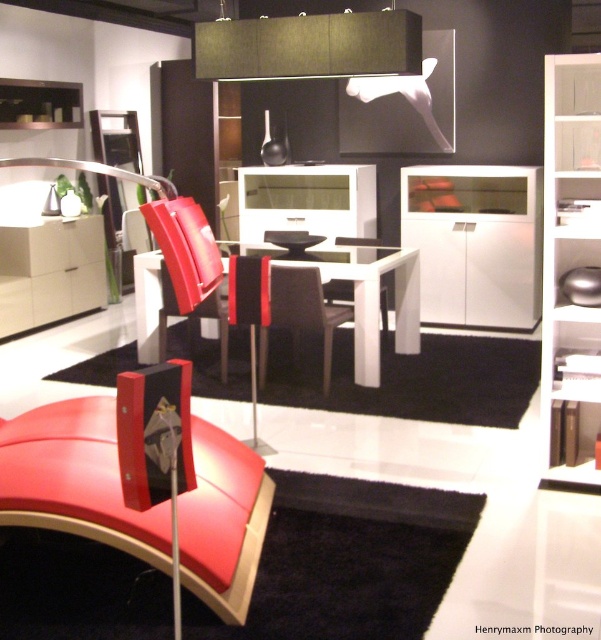
Is white matte cabinet at center positioned before black leather armchair at center?

No, white matte cabinet at center is behind black leather armchair at center.

Who is more distant from viewer, (522, 294) or (302, 269)?

The point (522, 294) is more distant.

The height and width of the screenshot is (640, 601). Describe the element at coordinates (475, 243) in the screenshot. I see `white matte cabinet at center` at that location.

Find the location of `white matte cabinet at center`. white matte cabinet at center is located at coordinates (475, 243).

Can you confirm if white glossy table at center is bigger than white glossy armchair at center?

Yes.

Is point (388, 264) positioned behind point (385, 332)?

No, (388, 264) is in front of (385, 332).

Find the location of a particular element. The height and width of the screenshot is (640, 601). white glossy table at center is located at coordinates coord(373,298).

Does white matte cabinet at center have a smaller size compared to white glossy table at center?

Correct, white matte cabinet at center occupies less space than white glossy table at center.

Describe the element at coordinates (475, 243) in the screenshot. I see `white matte cabinet at center` at that location.

I want to click on white matte cabinet at center, so pyautogui.click(x=475, y=243).